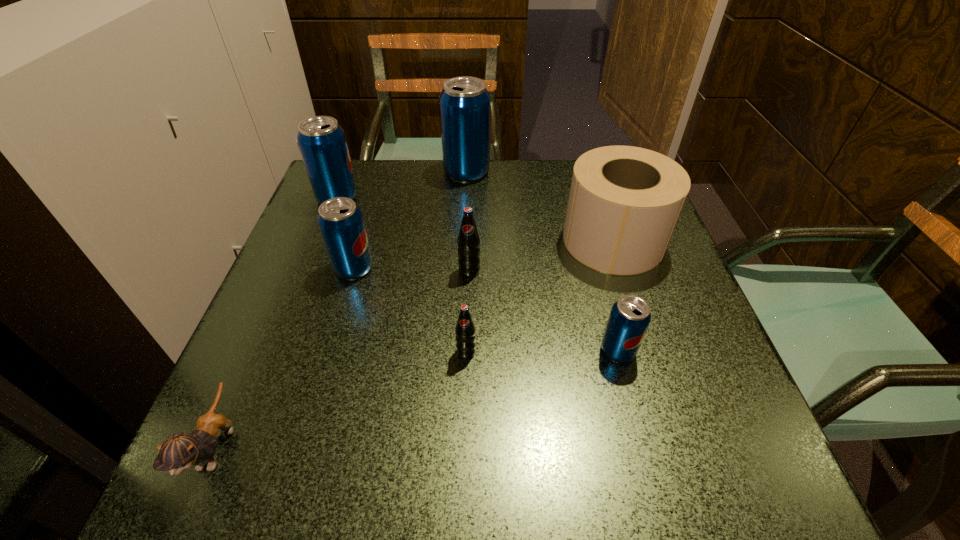
The width and height of the screenshot is (960, 540). I want to click on the shortest object, so click(x=179, y=452).

You are a GUI agent. You are given a task and a screenshot of the screen. Output one action in this format:
    pyautogui.click(x=<x>, y=<y>)
    Task: Click on the kitten
    The height and width of the screenshot is (540, 960).
    Given the screenshot: What is the action you would take?
    pyautogui.click(x=179, y=452)

At what (x,y) coordinates should I click in order to perform the action: click on vacant space positioned 0.330m on the front of the biggest blue pop soda. Please return your answer as a coordinate pair (x, y). The width and height of the screenshot is (960, 540). Looking at the image, I should click on (463, 274).

Where is `free space located on the back of the second farthest blue pop soda`? The image size is (960, 540). free space located on the back of the second farthest blue pop soda is located at coordinates (348, 170).

Where is `vacant space located on the back of the toilet tissue`? The height and width of the screenshot is (540, 960). vacant space located on the back of the toilet tissue is located at coordinates (588, 166).

Image resolution: width=960 pixels, height=540 pixels. What are the coordinates of `free location located 0.100m on the front of the third biggest blue pop soda` in the screenshot? It's located at (338, 321).

Identify the location of blank space located on the front label of the bigger black pop. (466, 426).

Locate an element on the screen. The width and height of the screenshot is (960, 540). vacant space situated on the back of the smallest blue pop soda is located at coordinates (579, 205).

Where is `free space located 0.090m on the front label of the smaller black pop`? The image size is (960, 540). free space located 0.090m on the front label of the smaller black pop is located at coordinates (465, 407).

Where is `toilet tissue situated at the far edge`? toilet tissue situated at the far edge is located at coordinates (624, 203).